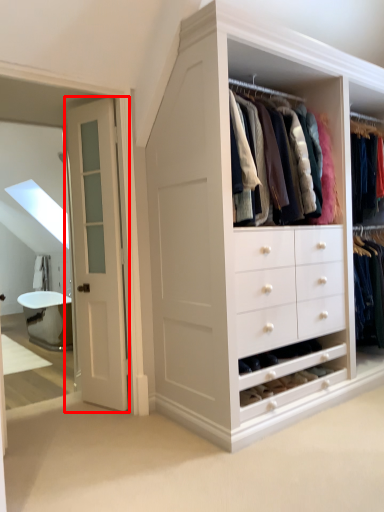
Question: From the image's perspective, what is the correct spatial relationship of door (annotated by the red box) in relation to bath?

Choices:
 (A) above
 (B) below

Answer: (A)